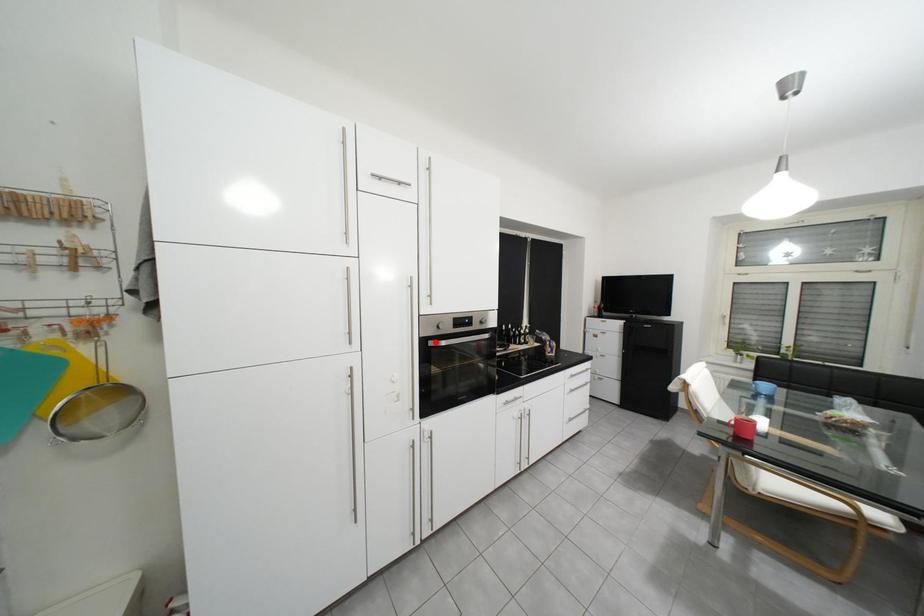
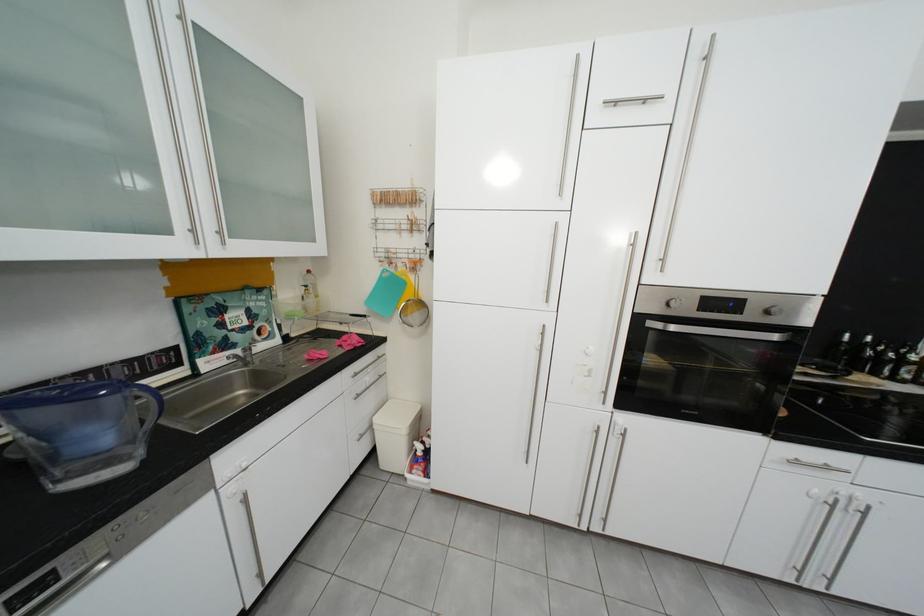
Where in the second image is the point corresponding to the highlighted location from the first image?

(650, 320)